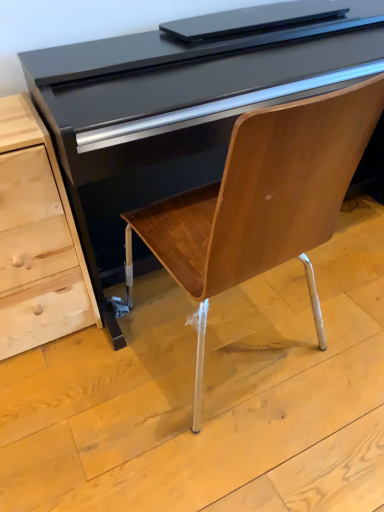
Locate an element on the screen. free point below glossy black piano at center (from a real-world perspective) is located at coordinates [x=224, y=336].